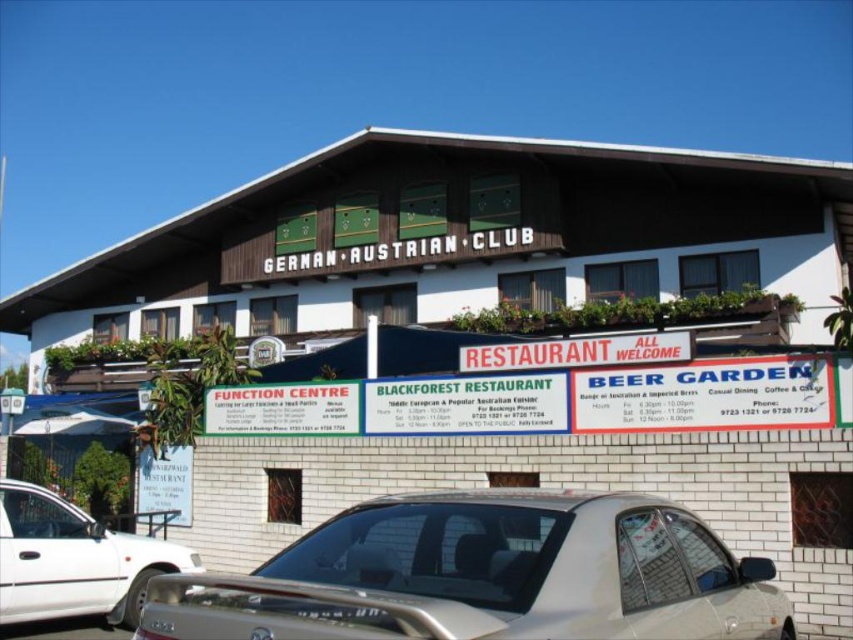
Who is more distant from viewer, (x=55, y=540) or (x=515, y=360)?

The point (x=515, y=360) is more distant.

Does white glossy sedan at lower left have a smaller size compared to white plastic signboard at center?

No, white glossy sedan at lower left is not smaller than white plastic signboard at center.

Locate an element on the screen. Image resolution: width=853 pixels, height=640 pixels. white glossy sedan at lower left is located at coordinates (73, 561).

Is silver metallic car at center below white glossy sedan at lower left?

Incorrect, silver metallic car at center is not positioned below white glossy sedan at lower left.

Which is above, silver metallic car at center or white glossy sedan at lower left?

A: silver metallic car at center is above.

Does point (637, 595) come in front of point (68, 611)?

That is True.

Find the location of a particular element. silver metallic car at center is located at coordinates (485, 576).

Who is higher up, silver metallic car at center or white plastic signboard at center?

white plastic signboard at center

Where is `silver metallic car at center`? silver metallic car at center is located at coordinates (485, 576).

Which is in front, point (508, 554) or point (515, 353)?

Point (508, 554)

Identify the location of silver metallic car at center. (485, 576).